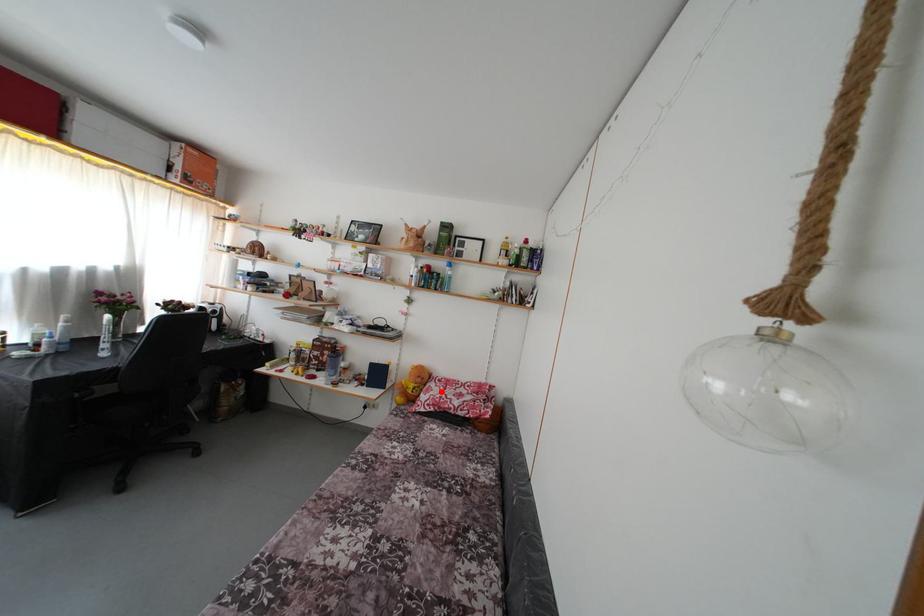
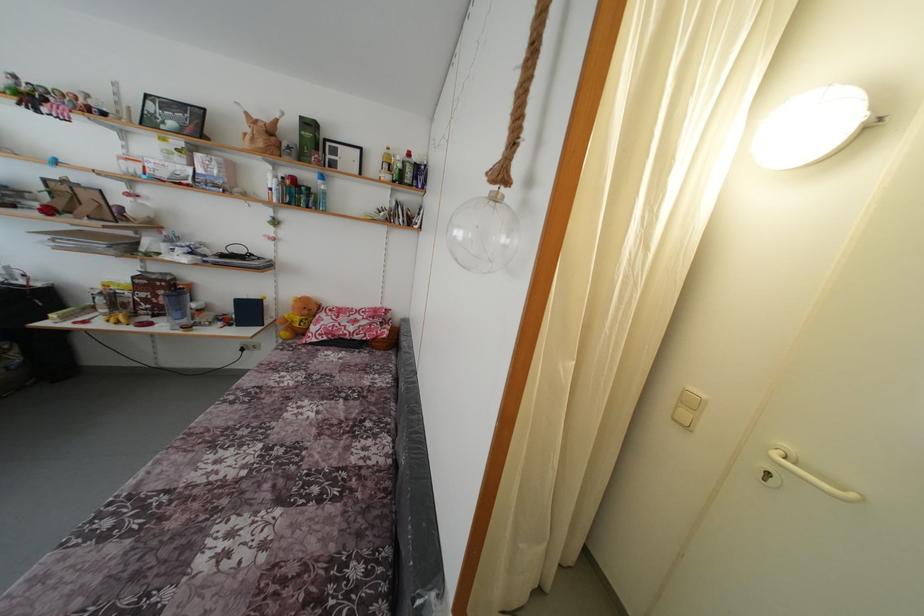
Where in the second image is the point corresponding to the highlighted location from the first image?

(332, 321)